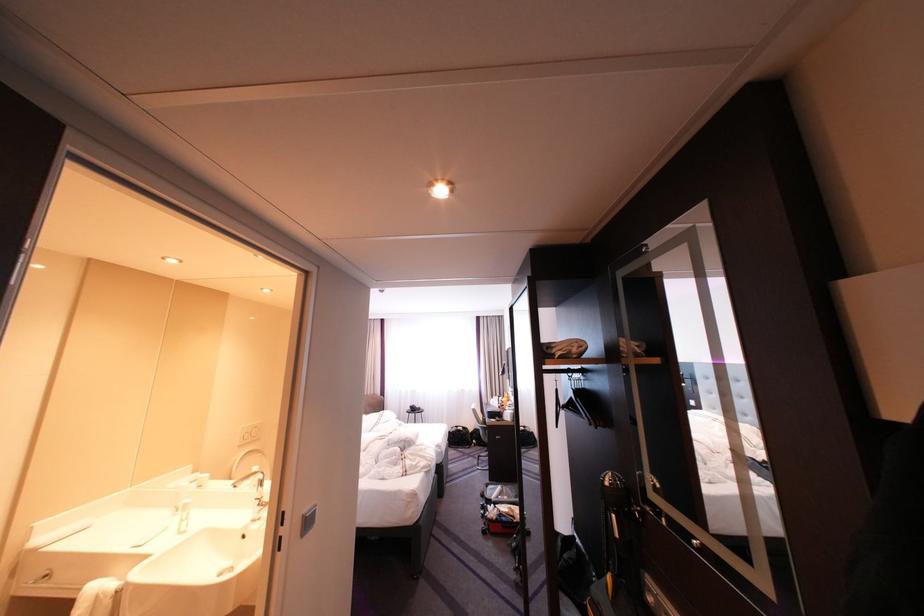
Where is `white soap dispenser`? white soap dispenser is located at coordinates (184, 516).